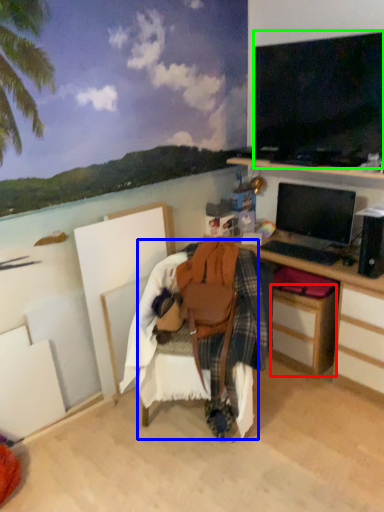
Question: Based on their relative distances, which object is farther from drawer (highlighted by a red box)? Choose from chair (highlighted by a blue box) and television (highlighted by a green box).

Choices:
 (A) chair
 (B) television

Answer: (B)